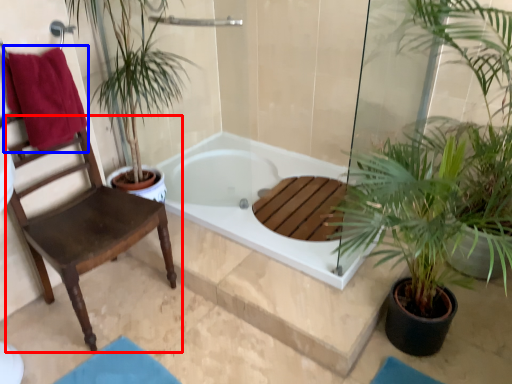
Question: Which point is further to the camera, chair (highlighted by a red box) or beach towel (highlighted by a blue box)?

Choices:
 (A) chair
 (B) beach towel

Answer: (B)